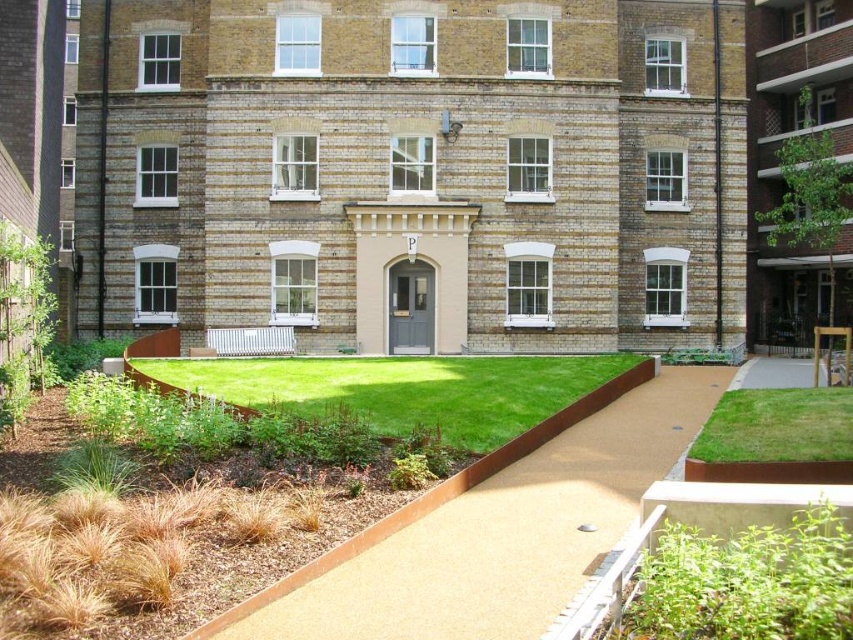
Does resin-coated pathway at center appear on the left side of green grass at lower right?

Correct, you'll find resin-coated pathway at center to the left of green grass at lower right.

Is resin-coated pathway at center taller than green grass at lower right?

Yes.

Does point (573, 586) come behind point (773, 452)?

No.

At what (x,y) coordinates should I click in order to perform the action: click on resin-coated pathway at center. Please return your answer as a coordinate pair (x, y). This screenshot has width=853, height=640. Looking at the image, I should click on (491, 532).

Is green grass at center taller than green grass at lower right?

Correct, green grass at center is much taller as green grass at lower right.

Does point (506, 358) come farther from viewer compared to point (846, 416)?

Yes, it is.

Which is behind, point (316, 412) or point (825, 410)?

Point (316, 412)

Locate an element on the screen. This screenshot has height=640, width=853. green grass at center is located at coordinates (405, 388).

Does resin-coated pathway at center appear under green grass at center?

Yes.

Is point (498, 502) positioned after point (456, 417)?

That is False.

Locate an element on the screen. This screenshot has height=640, width=853. resin-coated pathway at center is located at coordinates (491, 532).